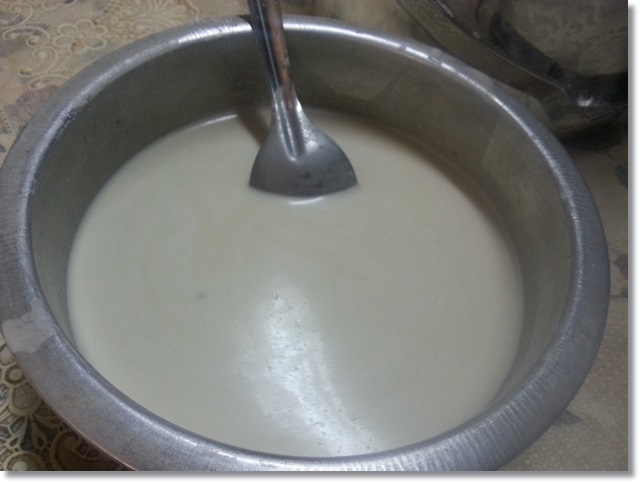
Find the location of a particular element. rim on bowl is located at coordinates (572, 372), (182, 454), (22, 297), (572, 192), (355, 32).